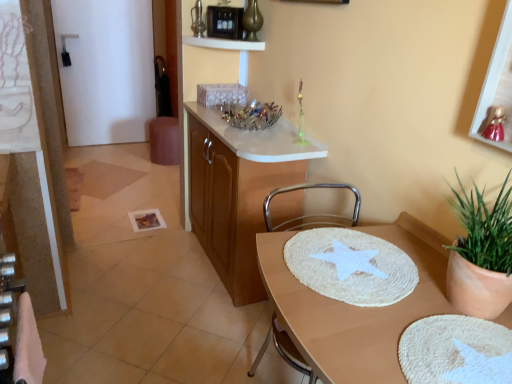
Question: Should I look upward or downward to see black plastic microwave at upper center?

Choices:
 (A) up
 (B) down

Answer: (A)

Question: Is white woven mat at center facing towards metallic gold picture frame at upper right?

Choices:
 (A) no
 (B) yes

Answer: (A)

Question: Is metallic gold picture frame at upper right inside white woven mat at center?

Choices:
 (A) no
 (B) yes

Answer: (A)

Question: From a real-world perspective, is white woven mat at center positioned under metallic gold picture frame at upper right based on gravity?

Choices:
 (A) no
 (B) yes

Answer: (B)

Question: Is white woven mat at center at the left side of metallic gold picture frame at upper right?

Choices:
 (A) yes
 (B) no

Answer: (A)

Question: Considering the relative positions of white woven mat at center and metallic gold picture frame at upper right in the image provided, is white woven mat at center to the right of metallic gold picture frame at upper right from the viewer's perspective?

Choices:
 (A) no
 (B) yes

Answer: (A)

Question: Is white woven mat at center closer to the viewer compared to metallic gold picture frame at upper right?

Choices:
 (A) yes
 (B) no

Answer: (B)

Question: Considering the relative sizes of white glossy shelf at upper center and gold metallic vase at upper center in the image provided, is white glossy shelf at upper center bigger than gold metallic vase at upper center?

Choices:
 (A) yes
 (B) no

Answer: (A)

Question: Is white glossy shelf at upper center taller than gold metallic vase at upper center?

Choices:
 (A) no
 (B) yes

Answer: (A)

Question: Is white glossy shelf at upper center far from gold metallic vase at upper center?

Choices:
 (A) no
 (B) yes

Answer: (A)

Question: Would you say gold metallic vase at upper center is part of white glossy shelf at upper center's contents?

Choices:
 (A) no
 (B) yes

Answer: (A)

Question: Would you say white glossy shelf at upper center is outside gold metallic vase at upper center?

Choices:
 (A) no
 (B) yes

Answer: (B)

Question: Does white glossy shelf at upper center have a greater width compared to gold metallic vase at upper center?

Choices:
 (A) yes
 (B) no

Answer: (A)

Question: Are gold metallic vase at upper center and black plastic microwave at upper center making contact?

Choices:
 (A) no
 (B) yes

Answer: (B)